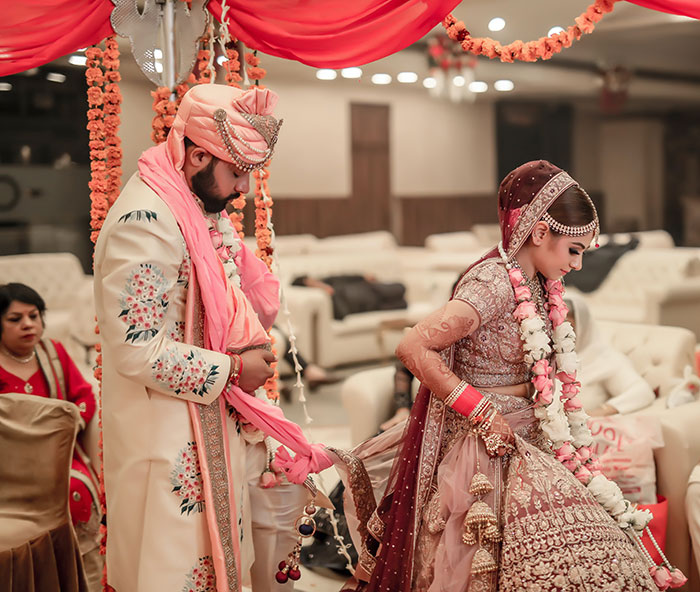
Locate an element on the screen. The height and width of the screenshot is (592, 700). curtain is located at coordinates (309, 12), (46, 15).